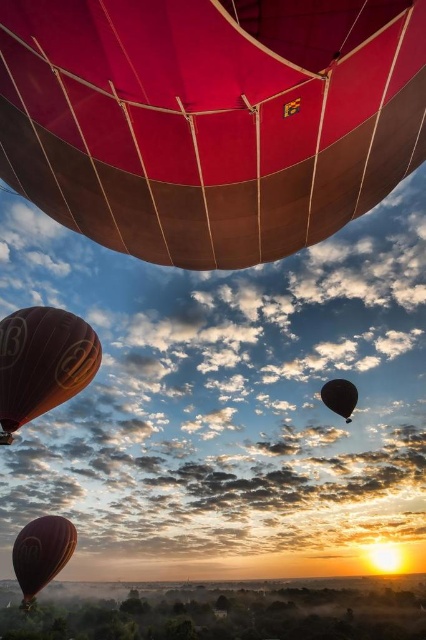
You are standing in the field looking at the scene. Which of the two balloons, the matte orange balloon at lower left or the matte brown hot air balloon at lower left, is positioned more to the right?

The matte orange balloon at lower left is positioned more to the right than the matte brown hot air balloon at lower left.

From the picture: You are a photographer trying to capture the matte red balloon at upper center and the black glossy balloon at lower right in the same frame. Based on their positions, which balloon would appear closer to the camera in the photo?

The matte red balloon at upper center appears closer to the camera because it is in front of the black glossy balloon at lower right.